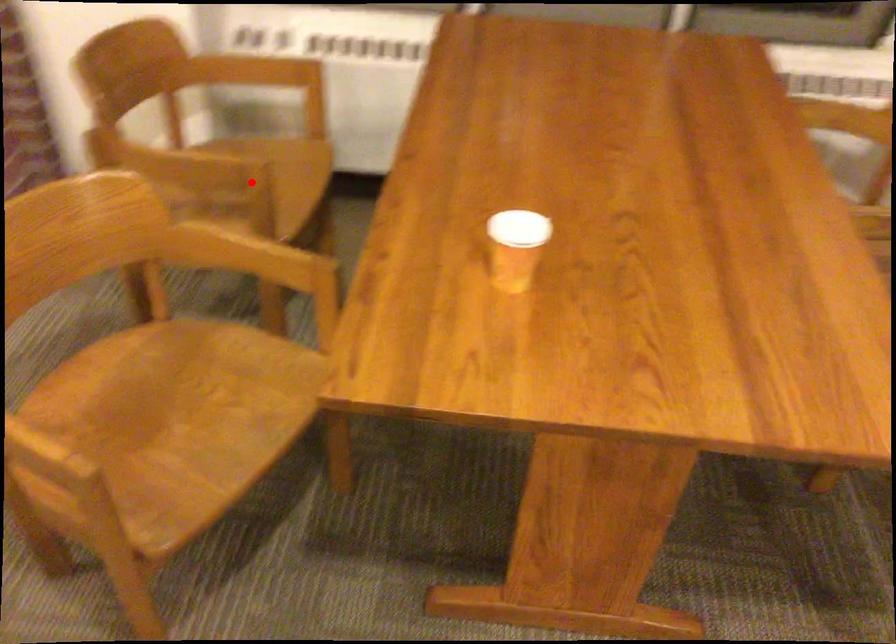
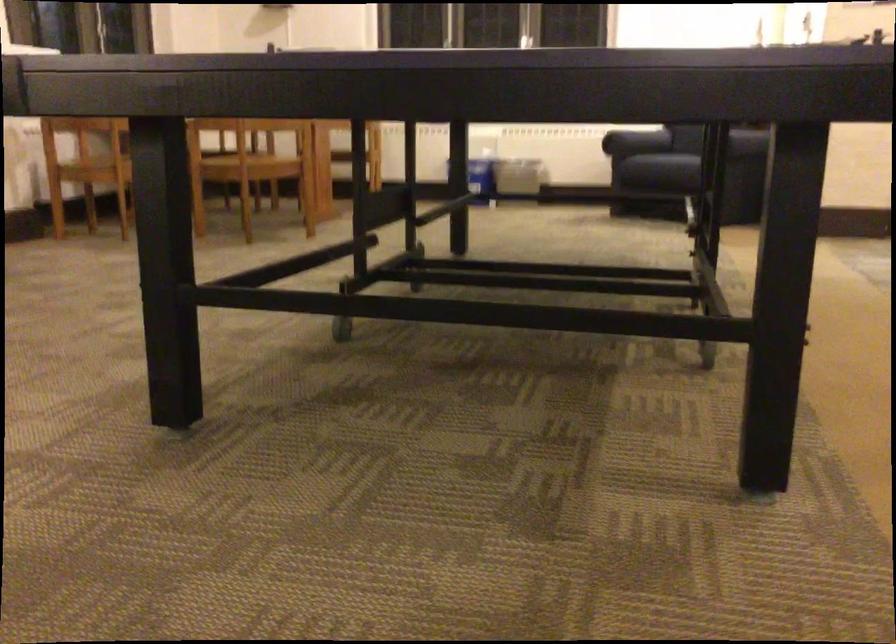
Question: I am providing you with two images of the same scene from different viewpoints. A red point is marked on the first image. Can you still see the location of the red point in image 2?

Choices:
 (A) Yes
 (B) No

Answer: (B)